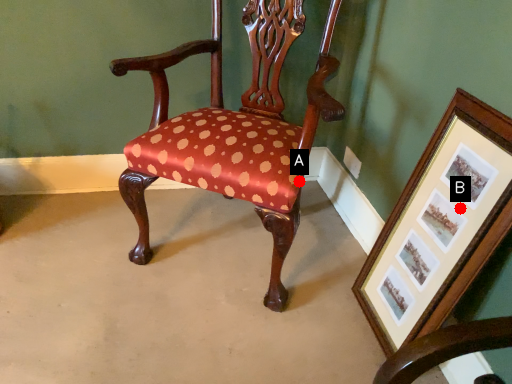
Question: Two points are circled on the image, labeled by A and B beside each circle. Which of the following is the farthest from the observer?

Choices:
 (A) A is further
 (B) B is further

Answer: (A)